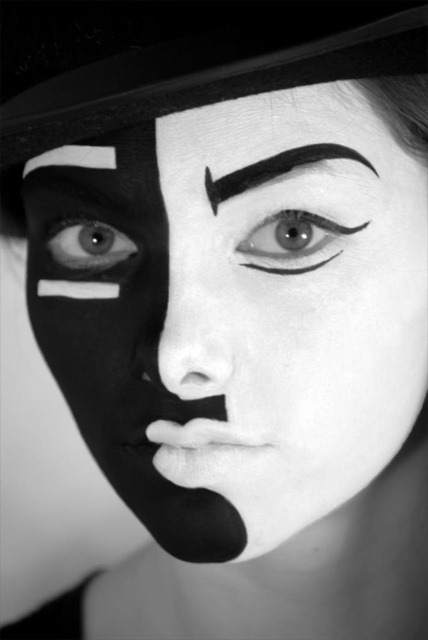
Question: Which point is closer to the camera?

Choices:
 (A) black smooth eyebrow at upper center
 (B) black matte face at center

Answer: (B)

Question: Can you confirm if smooth matte nose at center is positioned to the left of smooth matte eye at center?

Choices:
 (A) no
 (B) yes

Answer: (B)

Question: Which of the following is the farthest from the observer?

Choices:
 (A) (265, 224)
 (B) (107, 244)
 (C) (171, 346)
 (D) (419, 58)

Answer: (B)

Question: Does black matte face at center appear over black felt hat at upper center?

Choices:
 (A) yes
 (B) no

Answer: (B)

Question: Among these points, which one is nearest to the camera?

Choices:
 (A) (362, 163)
 (B) (174, 340)
 (C) (288, 115)
 (D) (300, 20)

Answer: (D)

Question: Is black felt hat at upper center bigger than matte black eye at center?

Choices:
 (A) no
 (B) yes

Answer: (B)